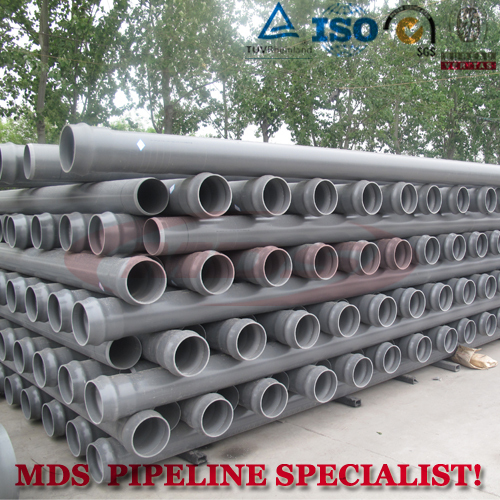
Where is `visible pipes in bottom row`? The height and width of the screenshot is (500, 500). visible pipes in bottom row is located at coordinates (101, 464), (75, 436), (51, 426), (30, 405), (11, 393).